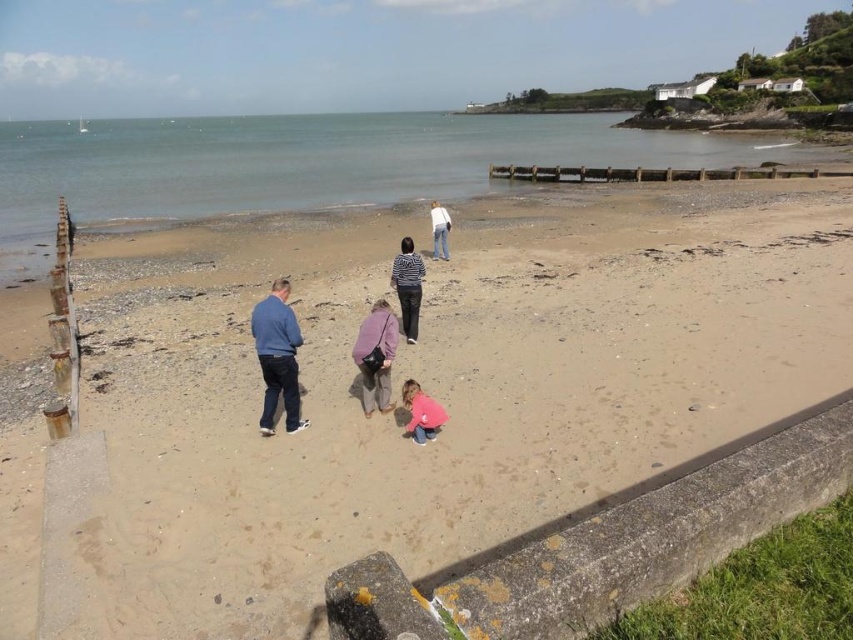
Question: In this image, where is sandy beach at center located relative to white cotton shirt at center?

Choices:
 (A) below
 (B) above

Answer: (A)

Question: Can you confirm if blue cotton shirt at lower left is positioned below pink fabric at center?

Choices:
 (A) yes
 (B) no

Answer: (B)

Question: Observing the image, what is the correct spatial positioning of blue cotton shirt at lower left in reference to white cotton shirt at center?

Choices:
 (A) right
 (B) left

Answer: (B)

Question: Which of the following is the closest to the observer?

Choices:
 (A) (415, 304)
 (B) (434, 257)
 (C) (97, 420)
 (D) (404, 404)

Answer: (D)

Question: Among these objects, which one is farthest from the camera?

Choices:
 (A) sandy beach at center
 (B) striped fabric shirt at center
 (C) pink fabric at center

Answer: (B)

Question: Which point is farther to the camera?

Choices:
 (A) striped fabric shirt at center
 (B) pink fabric at center
 (C) matte purple jacket at center

Answer: (A)